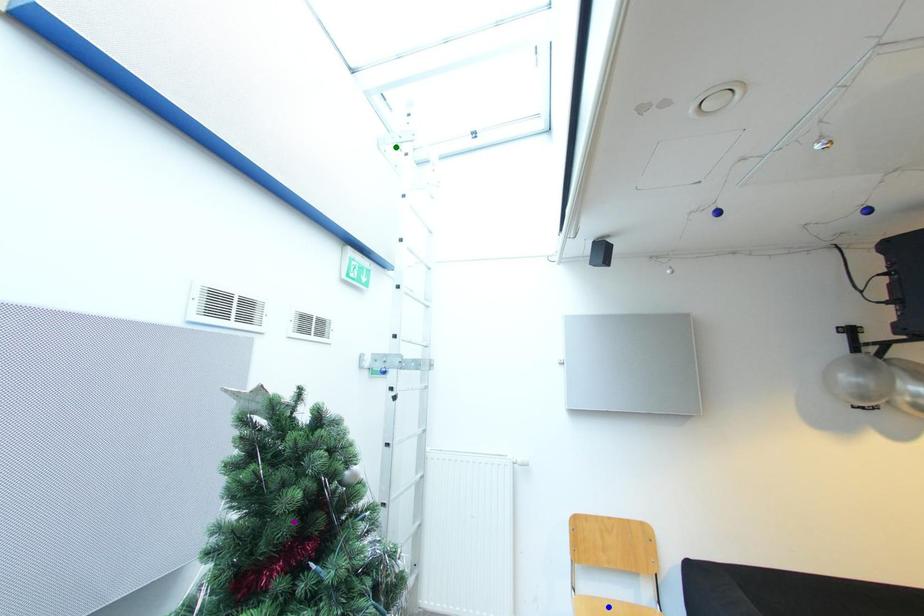
Order these from nearest to farthest:
A) blue point
B) green point
C) purple point

purple point, blue point, green point